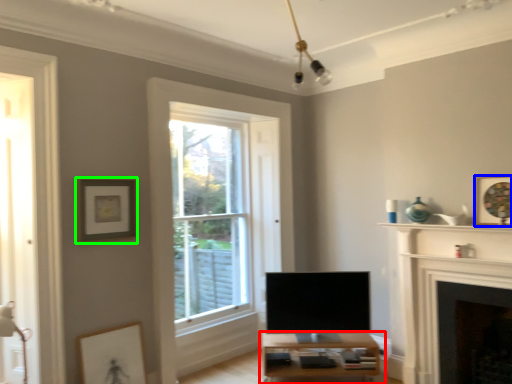
Question: Which object is positioned closest to table (highlighted by a red box)? Select from picture frame (highlighted by a blue box) and picture frame (highlighted by a green box).

Choices:
 (A) picture frame
 (B) picture frame

Answer: (A)